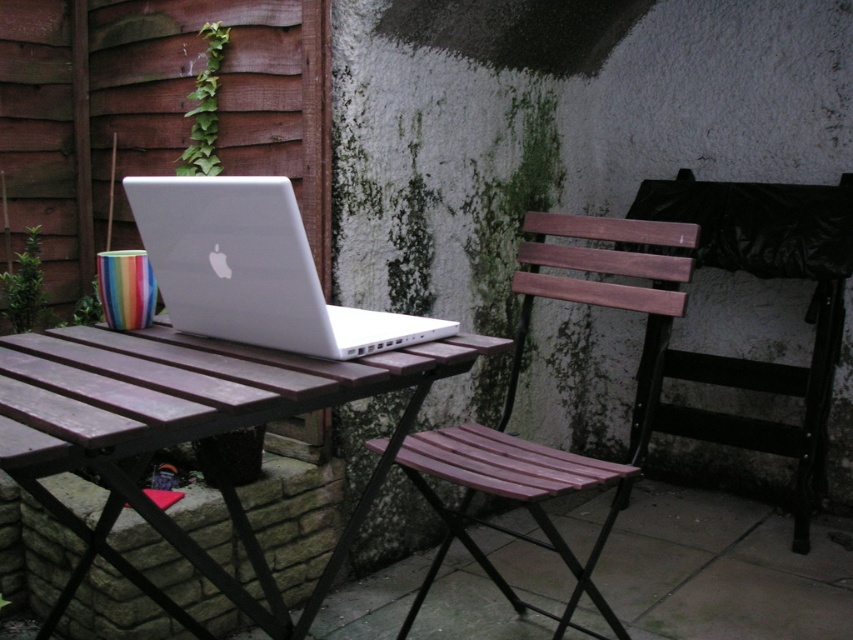
You are planning to place a small potted plant on the wooden folding table. Based on the current setup, where should you position the plant to ensure it doesn not obstruct the view of the wooden slats chair at center from the viewer s perspective?

The wooden slats chair at center is located at point (514,394), so positioning the plant away from that area would keep the chair visible.

Based on the photo, you are standing in the backyard and want to place a 36 inch long garden hose on the wooden table at center. Can the garden hose fit on the table without overhanging?

The wooden table at center is 34.29 inches away from camera, so the garden hose is longer than the table. Therefore, the garden hose cannot fit on the wooden table at center without overhanging.